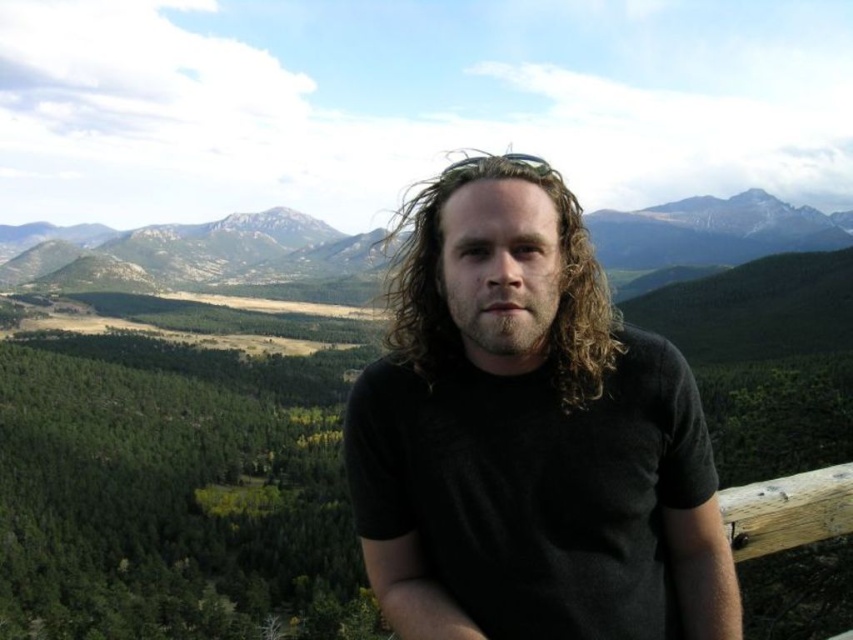
Question: Is curly blonde hair at center bigger than brown fuzzy beard at center?

Choices:
 (A) yes
 (B) no

Answer: (A)

Question: Does black matte shirt at center appear on the right side of brown fuzzy beard at center?

Choices:
 (A) no
 (B) yes

Answer: (B)

Question: Which of these objects is positioned closest to the black matte shirt at center?

Choices:
 (A) curly blonde hair at center
 (B) brown fuzzy beard at center

Answer: (B)

Question: Among these objects, which one is farthest from the camera?

Choices:
 (A) curly blonde hair at center
 (B) black matte shirt at center
 (C) green forested mountains at upper center
 (D) brown fuzzy beard at center

Answer: (D)

Question: Is green forested mountains at upper center further to the viewer compared to brown fuzzy beard at center?

Choices:
 (A) no
 (B) yes

Answer: (A)

Question: Which point appears farthest from the camera in this image?

Choices:
 (A) (421, 355)
 (B) (483, 486)
 (C) (532, 268)
 (D) (138, 636)

Answer: (D)